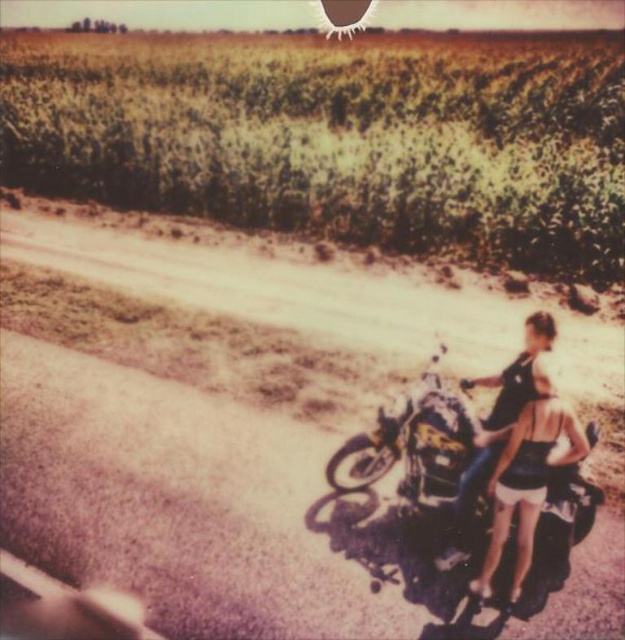
Question: Does shiny chrome motorcycle at lower right appear on the left side of denim shorts at lower right?

Choices:
 (A) yes
 (B) no

Answer: (A)

Question: Which object is positioned farthest from the shiny chrome motorcycle at lower right?

Choices:
 (A) matte black motorcycle at right
 (B) denim shorts at lower right
 (C) green grass at upper center

Answer: (C)

Question: Which point appears closest to the camera in this image?

Choices:
 (A) (260, 92)
 (B) (428, 506)
 (C) (515, 397)

Answer: (C)

Question: Estimate the real-world distances between objects in this image. Which object is closer to the matte black motorcycle at right?

Choices:
 (A) shiny chrome motorcycle at lower right
 (B) green grass at upper center
 (C) denim shorts at lower right

Answer: (A)

Question: Does green grass at upper center have a smaller size compared to denim shorts at lower right?

Choices:
 (A) no
 (B) yes

Answer: (A)

Question: Can you confirm if shiny chrome motorcycle at lower right is positioned above matte black motorcycle at right?

Choices:
 (A) no
 (B) yes

Answer: (A)